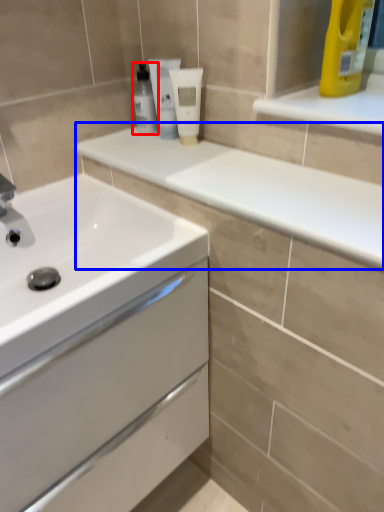
Question: Which object appears farthest to the camera in this image, mouthwash (highlighted by a red box) or counter top (highlighted by a blue box)?

Choices:
 (A) mouthwash
 (B) counter top

Answer: (A)